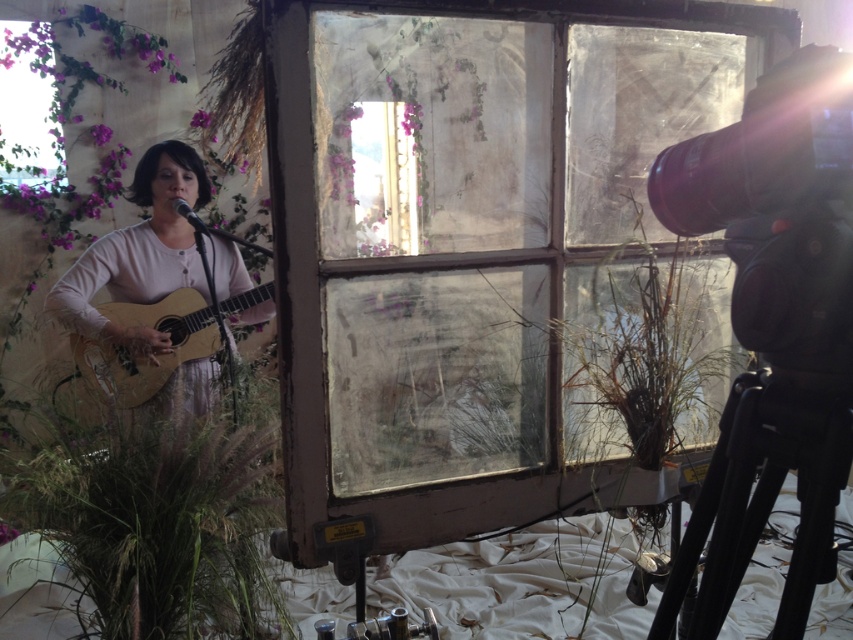
You are a camera operator trying to capture a closeup shot of the woman performing. You need to adjust your camera to focus on the point at coordinates point (227, 582). What should the focus distance be set to in meters?

The focus distance should be set to 1.85 meters because the point (227, 582) is 1.85 meters away from the camera.

You are setting up a camera on the black matte tripod at lower right to film the acoustic wood guitar at left. Since the tripod is narrower than the guitar, will you need a wider tripod to capture the entire guitar in the frame?

A: The black matte tripod at lower right is narrower than the acoustic wood guitar at left, so you will need a wider tripod to ensure the entire guitar fits within the frame.

You are a photographer setting up for a shoot. You need to position a small stool between the green grass at lower left and the matte pink dress at left. Which object should the stool be closer to if you want it to be placed at the same height as the taller object?

The stool should be placed closer to the matte pink dress at left because it is taller than the green grass at lower left, so positioning the stool near it will match the height.